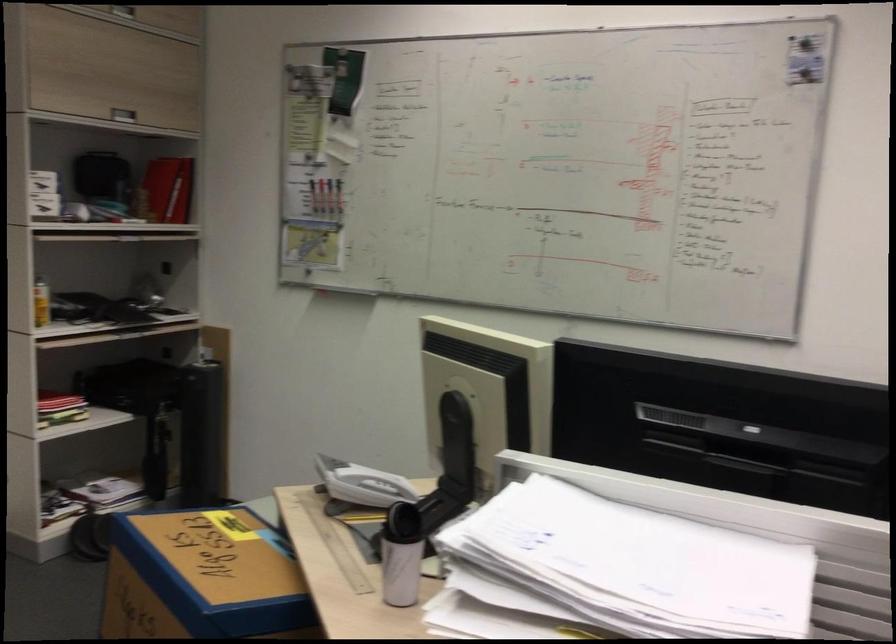
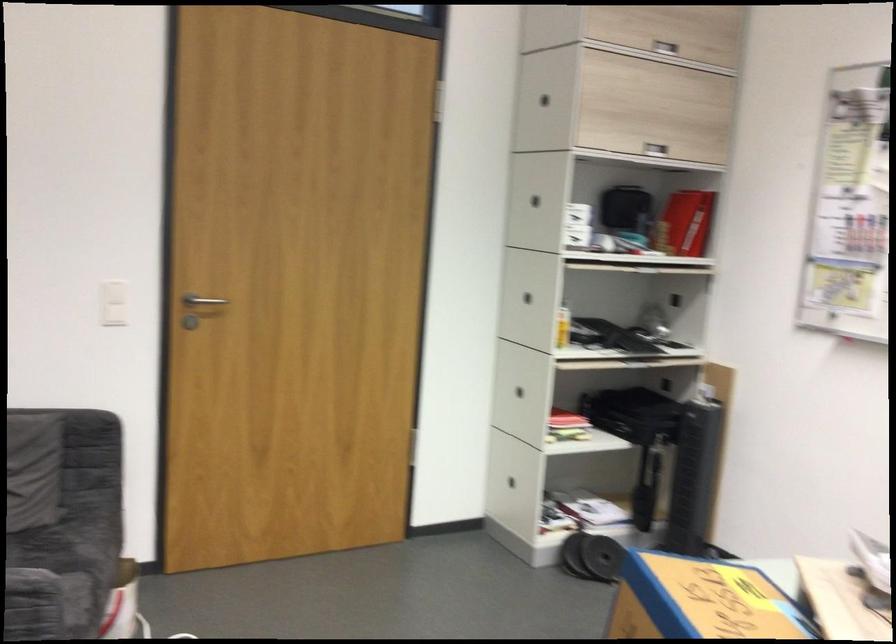
Question: How did the camera likely rotate?

Choices:
 (A) Left
 (B) Right
 (C) Up
 (D) Down

Answer: (A)